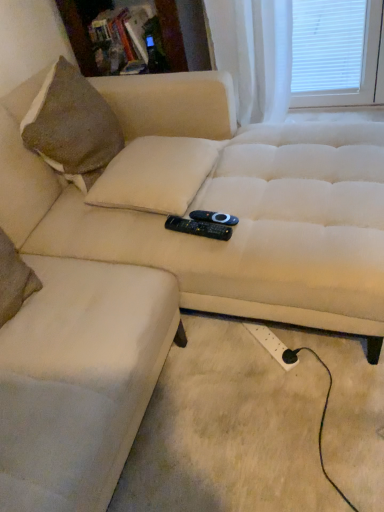
Question: Can you confirm if black plastic remote at center, the 1th remote positioned from the top, is shorter than black plastic remote at center, the second remote from the top?

Choices:
 (A) no
 (B) yes

Answer: (B)

Question: From a real-world perspective, is black plastic remote at center, the 1th remote positioned from the top, located higher than black plastic remote at center, which ranks as the 1th remote in bottom-to-top order?

Choices:
 (A) yes
 (B) no

Answer: (B)

Question: Is black plastic remote at center, the 2th remote from the bottom, outside black plastic remote at center, the second remote from the top?

Choices:
 (A) no
 (B) yes

Answer: (B)

Question: Can black plastic remote at center, which ranks as the 1th remote in bottom-to-top order, be found inside black plastic remote at center, the 1th remote positioned from the top?

Choices:
 (A) no
 (B) yes

Answer: (A)

Question: Is black plastic remote at center, the 2th remote from the bottom, to the right of black plastic remote at center, which ranks as the 1th remote in bottom-to-top order, from the viewer's perspective?

Choices:
 (A) no
 (B) yes

Answer: (B)

Question: Is white plastic extension cord at lower right to the left or to the right of black plastic remote at center, the 1th remote positioned from the top, in the image?

Choices:
 (A) left
 (B) right

Answer: (B)

Question: Considering the positions of white plastic extension cord at lower right and black plastic remote at center, the 2th remote from the bottom, in the image, is white plastic extension cord at lower right wider or thinner than black plastic remote at center, the 2th remote from the bottom,?

Choices:
 (A) thin
 (B) wide

Answer: (B)

Question: Considering the positions of point (296, 358) and point (223, 218), is point (296, 358) closer or farther from the camera than point (223, 218)?

Choices:
 (A) closer
 (B) farther

Answer: (B)

Question: From a real-world perspective, is white plastic extension cord at lower right positioned above or below black plastic remote at center, the 1th remote positioned from the top?

Choices:
 (A) below
 (B) above

Answer: (A)

Question: From a real-world perspective, is wooden bookshelf at upper center physically located above or below white plastic extension cord at lower right?

Choices:
 (A) above
 (B) below

Answer: (A)

Question: Is wooden bookshelf at upper center taller or shorter than white plastic extension cord at lower right?

Choices:
 (A) short
 (B) tall

Answer: (B)

Question: Do you think wooden bookshelf at upper center is within white plastic extension cord at lower right, or outside of it?

Choices:
 (A) inside
 (B) outside

Answer: (B)

Question: Is wooden bookshelf at upper center wider or thinner than white plastic extension cord at lower right?

Choices:
 (A) thin
 (B) wide

Answer: (B)

Question: In terms of width, does black plastic remote at center, the 1th remote positioned from the top, look wider or thinner when compared to black plastic remote at center, which ranks as the 1th remote in bottom-to-top order?

Choices:
 (A) thin
 (B) wide

Answer: (A)

Question: Is black plastic remote at center, the 1th remote positioned from the top, bigger or smaller than black plastic remote at center, which ranks as the 1th remote in bottom-to-top order?

Choices:
 (A) big
 (B) small

Answer: (B)